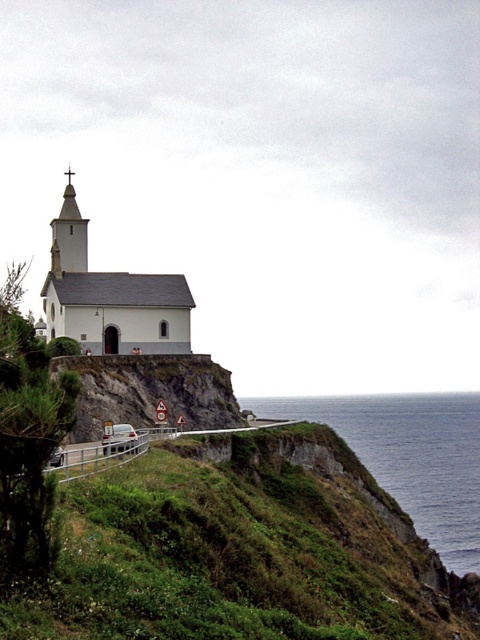
Who is more forward, (120, 556) or (479, 429)?

Point (120, 556) is more forward.

Is point (107, 576) more distant than point (375, 468)?

No, it is not.

Locate an element on the screen. The height and width of the screenshot is (640, 480). green grassy hillside at center is located at coordinates (241, 548).

The height and width of the screenshot is (640, 480). Identify the location of green grassy hillside at center. (241, 548).

At what (x,y) coordinates should I click in order to perform the action: click on green grassy hillside at center. Please return your answer as a coordinate pair (x, y). Looking at the image, I should click on (241, 548).

Does point (230, 508) come behind point (79, 250)?

That is False.

The image size is (480, 640). What do you see at coordinates (241, 548) in the screenshot? I see `green grassy hillside at center` at bounding box center [241, 548].

Where is `green grassy hillside at center`? This screenshot has height=640, width=480. green grassy hillside at center is located at coordinates (241, 548).

Which is more to the left, green grassy hillside at center or white matte church at center?

white matte church at center is more to the left.

Is green grassy hillside at center to the left of white matte church at center from the viewer's perspective?

Incorrect, green grassy hillside at center is not on the left side of white matte church at center.

Is point (199, 547) positioned in front of point (159, 348)?

That is True.

Identify the location of green grassy hillside at center. The height and width of the screenshot is (640, 480). (241, 548).